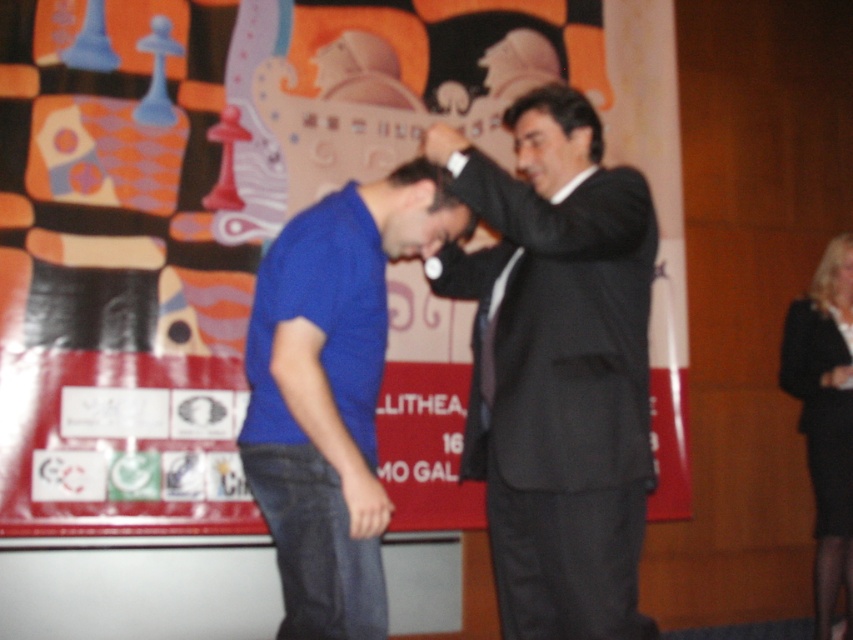
Question: Which of the following is the farthest from the observer?

Choices:
 (A) (367, 470)
 (B) (624, 456)
 (C) (828, 404)

Answer: (C)

Question: Which of the following is the closest to the observer?

Choices:
 (A) (312, 376)
 (B) (815, 301)
 (C) (558, 13)

Answer: (A)

Question: Is black suit at center below blue cotton shirt at center?

Choices:
 (A) yes
 (B) no

Answer: (B)

Question: Which is farther from the matte plastic chess piece at upper left?

Choices:
 (A) black suit at center
 (B) black fabric skirt at lower right

Answer: (B)

Question: Is blue cotton shirt at center to the right of black fabric skirt at lower right from the viewer's perspective?

Choices:
 (A) no
 (B) yes

Answer: (A)

Question: Does blue cotton shirt at center have a lesser width compared to black fabric skirt at lower right?

Choices:
 (A) yes
 (B) no

Answer: (B)